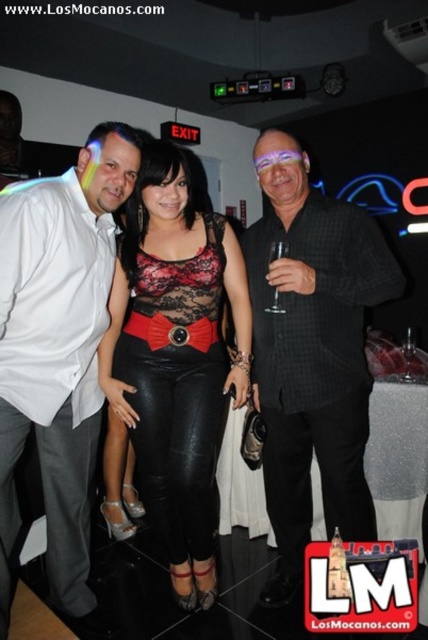
You are a photographer at the event and need to adjust the lighting to ensure both the black checkered shirt at center and the white shirt at left are well lit. Considering their sizes, which shirt requires a wider light spread to cover its entire surface?

The black checkered shirt at center requires a wider light spread because its width is larger than the white shirt at left.

You are a photographer at this event. You need to adjust the lighting so that the white shirt at left and the black leather pants at center are equally illuminated. Given their height difference, which object should you raise the light source closer to?

The white shirt at left is much taller than the black leather pants at center, so to equally illuminate both, the light source should be raised closer to the black leather pants at center to compensate for its shorter height.